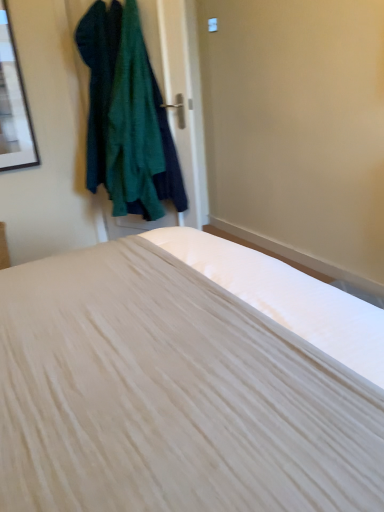
Question: Is dark green textured sweater at upper left, which appears as the second clothing when viewed from the right, not inside dark green textured sweater at upper left, which ranks as the second clothing in left-to-right order?

Choices:
 (A) no
 (B) yes

Answer: (A)

Question: Does dark green textured sweater at upper left, which appears as the second clothing when viewed from the right, have a greater height compared to dark green textured sweater at upper left, marked as the 1th clothing in a right-to-left arrangement?

Choices:
 (A) no
 (B) yes

Answer: (A)

Question: Considering the relative sizes of dark green textured sweater at upper left, which appears as the second clothing when viewed from the right, and dark green textured sweater at upper left, which ranks as the second clothing in left-to-right order, in the image provided, is dark green textured sweater at upper left, which appears as the second clothing when viewed from the right, shorter than dark green textured sweater at upper left, which ranks as the second clothing in left-to-right order,?

Choices:
 (A) no
 (B) yes

Answer: (B)

Question: Considering the relative positions of dark green textured sweater at upper left, which ranks as the first clothing in left-to-right order, and dark green textured sweater at upper left, marked as the 1th clothing in a right-to-left arrangement, in the image provided, is dark green textured sweater at upper left, which ranks as the first clothing in left-to-right order, to the left of dark green textured sweater at upper left, marked as the 1th clothing in a right-to-left arrangement, from the viewer's perspective?

Choices:
 (A) yes
 (B) no

Answer: (A)

Question: Is dark green textured sweater at upper left, which ranks as the first clothing in left-to-right order, not near dark green textured sweater at upper left, which ranks as the second clothing in left-to-right order?

Choices:
 (A) no
 (B) yes

Answer: (A)

Question: Is point (6, 13) positioned closer to the camera than point (36, 273)?

Choices:
 (A) closer
 (B) farther

Answer: (B)

Question: From a real-world perspective, is matte black picture frame at upper left physically located above or below white matte bed at center?

Choices:
 (A) below
 (B) above

Answer: (B)

Question: In the image, is matte black picture frame at upper left on the left side or the right side of white matte bed at center?

Choices:
 (A) right
 (B) left

Answer: (B)

Question: From the image's perspective, is matte black picture frame at upper left positioned above or below white matte bed at center?

Choices:
 (A) below
 (B) above

Answer: (B)

Question: Looking at their shapes, would you say dark green textured sweater at upper left, which ranks as the first clothing in left-to-right order, is wider or thinner than dark green textured sweater at upper left, which ranks as the second clothing in left-to-right order?

Choices:
 (A) wide
 (B) thin

Answer: (B)

Question: Based on their positions, is dark green textured sweater at upper left, which ranks as the first clothing in left-to-right order, located to the left or right of dark green textured sweater at upper left, marked as the 1th clothing in a right-to-left arrangement?

Choices:
 (A) right
 (B) left

Answer: (B)

Question: Considering the positions of dark green textured sweater at upper left, which appears as the second clothing when viewed from the right, and dark green textured sweater at upper left, marked as the 1th clothing in a right-to-left arrangement, in the image, is dark green textured sweater at upper left, which appears as the second clothing when viewed from the right, taller or shorter than dark green textured sweater at upper left, marked as the 1th clothing in a right-to-left arrangement,?

Choices:
 (A) short
 (B) tall

Answer: (A)

Question: Is dark green textured sweater at upper left, which ranks as the first clothing in left-to-right order, in front of or behind dark green textured sweater at upper left, which ranks as the second clothing in left-to-right order, in the image?

Choices:
 (A) behind
 (B) front

Answer: (A)

Question: From the image's perspective, is dark green textured sweater at upper left, which ranks as the second clothing in left-to-right order, above or below matte black picture frame at upper left?

Choices:
 (A) below
 (B) above

Answer: (A)

Question: Is dark green textured sweater at upper left, marked as the 1th clothing in a right-to-left arrangement, in front of or behind matte black picture frame at upper left in the image?

Choices:
 (A) behind
 (B) front

Answer: (B)